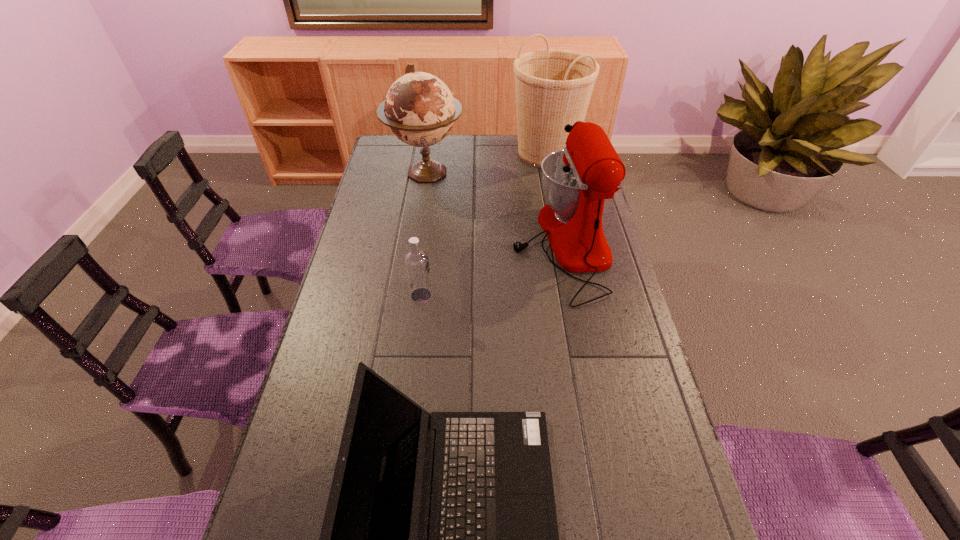
The height and width of the screenshot is (540, 960). In order to click on vacant area that lies between the globe and the basket in this screenshot , I will do `click(486, 163)`.

What are the coordinates of `free point between the globe and the basket` in the screenshot? It's located at (486, 163).

What are the coordinates of `free spot between the globe and the vodka` in the screenshot? It's located at (423, 234).

Where is `the third closest object to the basket`? The image size is (960, 540). the third closest object to the basket is located at coordinates (416, 261).

Find the location of a particular element. object that can be found as the closest to the globe is located at coordinates (576, 180).